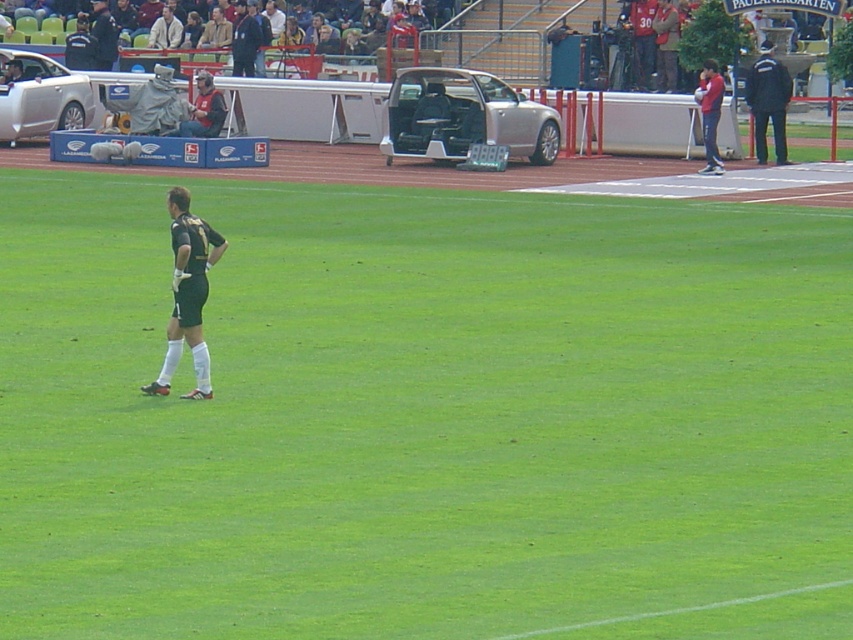
Who is more forward, [192,352] or [764,92]?

Point [192,352] is in front.

Which is in front, point (177, 360) or point (763, 116)?

Point (177, 360) is more forward.

Where is `dark green jersey at left`? dark green jersey at left is located at coordinates (187, 292).

Does point (280, 349) come closer to viewer compared to point (38, 74)?

Yes, it is.

In the scene shown: Who is higher up, green grass field at center or silver metallic sedan at left?

silver metallic sedan at left is above.

Who is more distant from viewer, (4, 579) or (38, 84)?

The point (38, 84) is more distant.

Image resolution: width=853 pixels, height=640 pixels. Find the location of `green grass field at center`. green grass field at center is located at coordinates (424, 416).

Can you confirm if green grass field at center is positioned to the left of green jersey at left?

No, green grass field at center is not to the left of green jersey at left.

Between green grass field at center and green jersey at left, which one has less height?

green jersey at left

Image resolution: width=853 pixels, height=640 pixels. Find the location of `green grass field at center`. green grass field at center is located at coordinates (424, 416).

Where is `green grass field at center`? Image resolution: width=853 pixels, height=640 pixels. green grass field at center is located at coordinates (424, 416).